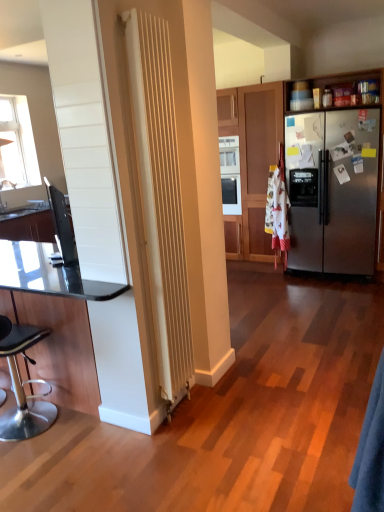
Question: Considering the positions of point (223, 96) and point (14, 387), is point (223, 96) closer or farther from the camera than point (14, 387)?

Choices:
 (A) farther
 (B) closer

Answer: (A)

Question: Choose the correct answer: Is stainless steel refrigerator at right inside black leather stool at lower left or outside it?

Choices:
 (A) outside
 (B) inside

Answer: (A)

Question: Which of these objects is positioned closest to the black laminate countertop at left?

Choices:
 (A) black glossy tv at left
 (B) blue fabric robe at lower right
 (C) stainless steel refrigerator at right
 (D) black leather stool at lower left
 (E) transparent glass table at left

Answer: (A)

Question: Which is farther from the black glossy tv at left?

Choices:
 (A) transparent glass table at left
 (B) black laminate countertop at left
 (C) black leather stool at lower left
 (D) blue fabric robe at lower right
 (E) stainless steel refrigerator at right

Answer: (E)